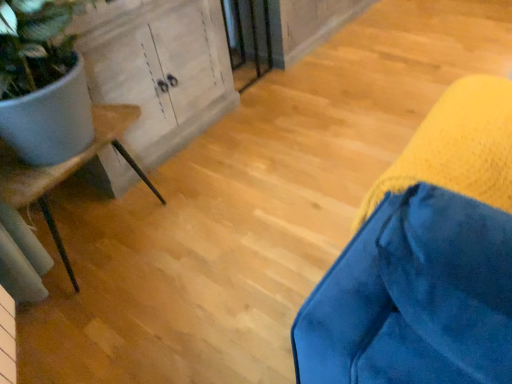
Identify the location of free location in front of wooden cabinet at left. (207, 206).